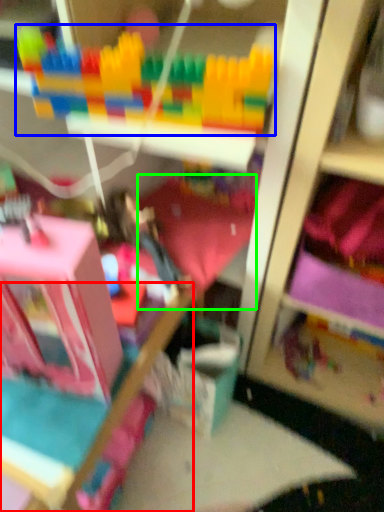
Question: Which object is the farthest from bed frame (highlighted by a red box)? Choose among these: toy (highlighted by a blue box) or bedding (highlighted by a green box).

Choices:
 (A) toy
 (B) bedding

Answer: (A)